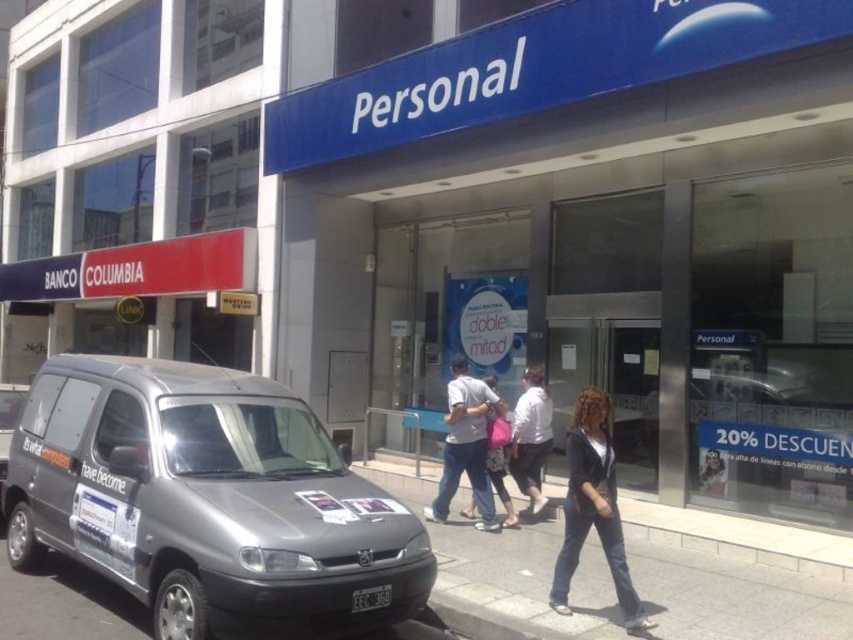
Question: Which object is the farthest from the denim pants at center?

Choices:
 (A) white cotton shirt at center
 (B) light gray concrete sidewalk at center
 (C) pink fabric bag at center

Answer: (B)

Question: Does denim jeans at lower right have a greater width compared to white cotton shirt at center?

Choices:
 (A) no
 (B) yes

Answer: (B)

Question: Is blue plastic sign at upper center bigger than light gray concrete sidewalk at center?

Choices:
 (A) no
 (B) yes

Answer: (B)

Question: Which of the following is the farthest from the observer?

Choices:
 (A) denim jeans at lower right
 (B) white cotton shirt at center
 (C) silver metallic van at center-left

Answer: (B)

Question: Where is silver metallic van at center-left located in relation to pink fabric bag at center in the image?

Choices:
 (A) above
 (B) below

Answer: (A)

Question: Which object is the farthest from the denim jeans at lower right?

Choices:
 (A) blue plastic sign at upper center
 (B) light gray concrete sidewalk at center
 (C) silver metallic van at center-left
 (D) denim pants at center

Answer: (A)